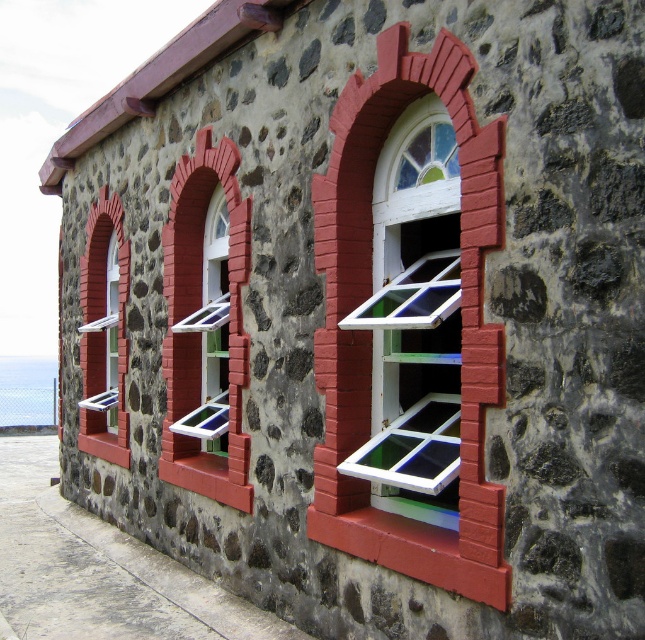
Is white painted wood at center further to the viewer compared to matte glass window at center?

No, it is in front of matte glass window at center.

Which is in front, point (353, 355) or point (163, 472)?

Point (353, 355) is more forward.

Does point (321, 209) come in front of point (243, 497)?

Yes, it is.

I want to click on white painted wood at center, so click(x=370, y=339).

Locate an element on the screen. matte glass window at center is located at coordinates (204, 326).

Does matte glass window at center have a greater width compared to matte glass window at left?

No.

Locate an element on the screen. This screenshot has width=645, height=640. matte glass window at center is located at coordinates (204, 326).

Is point (432, 56) farther from viewer compared to point (88, 275)?

That is False.

Can you confirm if white painted wood at center is positioned to the right of matte glass window at left?

Correct, you'll find white painted wood at center to the right of matte glass window at left.

Is point (470, 440) farther from camera compared to point (115, 294)?

No, it is in front of (115, 294).

You are a GUI agent. You are given a task and a screenshot of the screen. Output one action in this format:
    pyautogui.click(x=<x>, y=<y>)
    Task: Click on the white painted wood at center
    This screenshot has width=645, height=640.
    Given the screenshot: What is the action you would take?
    pyautogui.click(x=370, y=339)